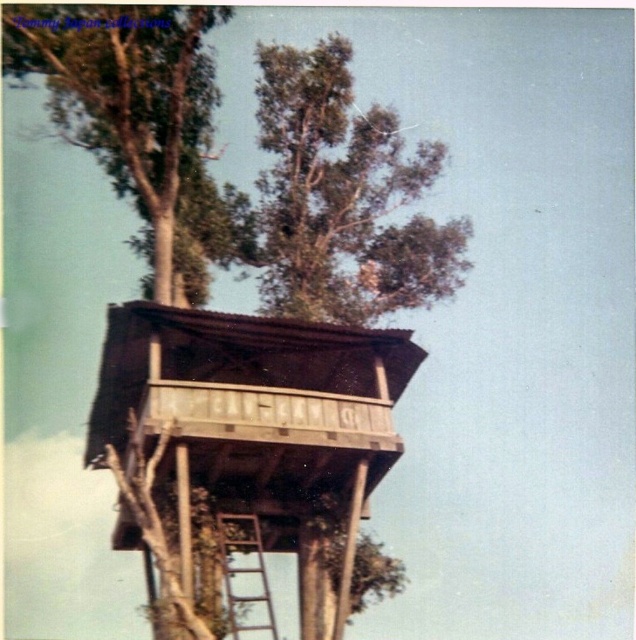
Can you confirm if green leafy tree at upper center is shorter than wooden ladder at center?

No, green leafy tree at upper center is not shorter than wooden ladder at center.

Based on the photo, who is more forward, [356,124] or [268,595]?

Point [268,595]

Identify the location of green leafy tree at upper center. (342, 196).

Is point (377, 413) behind point (333, 116)?

No.

Does point (149, 592) come in front of point (259, 86)?

Yes, it is.

The height and width of the screenshot is (640, 636). What do you see at coordinates (254, 416) in the screenshot?
I see `brown wooden hut at upper center` at bounding box center [254, 416].

The width and height of the screenshot is (636, 640). I want to click on brown wooden hut at upper center, so click(254, 416).

Is brown wooden hut at upper center smaller than wooden ladder at center?

No.

Who is positioned more to the right, brown wooden hut at upper center or wooden ladder at center?

wooden ladder at center

Locate an element on the screen. This screenshot has width=636, height=640. brown wooden hut at upper center is located at coordinates [x=254, y=416].